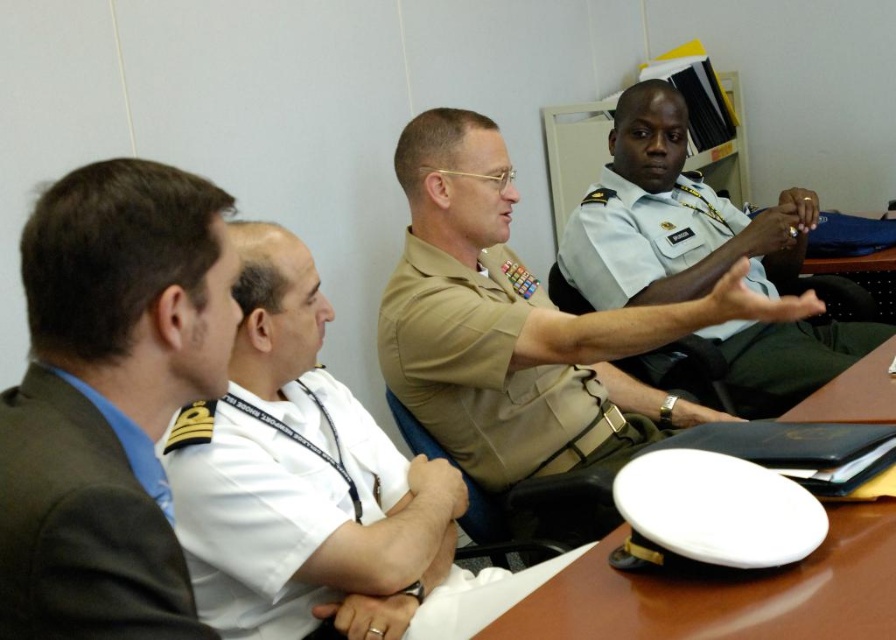
You are standing at the entrance of the conference room and want to greet both the tan uniform at center and the light blue uniform at center. If you walk straight ahead, which one will you reach first?

The tan uniform at center and the light blue uniform at center are both at the same distance from you since they are positioned at the center of the image. However, the tan uniform at center is 59.07 centimeters closer to the light blue uniform at center than to the entrance, so you would reach the light blue uniform at center first if they are aligned along your path.

What are the coordinates of the tan uniform at center?

The tan uniform at center is located at coordinates point [518,324].

Based on the scene description, where is the tan uniform at center located in the image?

The tan uniform at center is located at point (x=518, y=324).